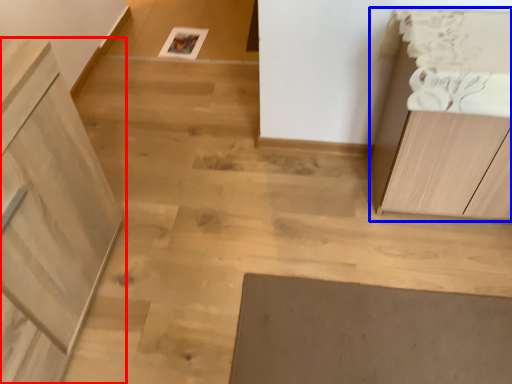
Question: Which object appears closest to the camera in this image, cabinetry (highlighted by a red box) or cabinetry (highlighted by a blue box)?

Choices:
 (A) cabinetry
 (B) cabinetry

Answer: (A)